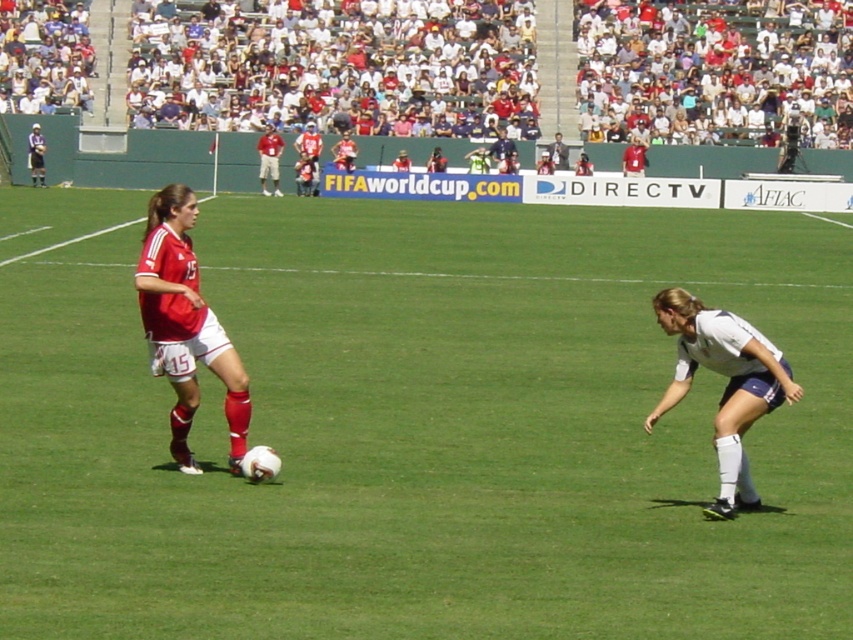
Question: Considering the real-world distances, which object is farthest from the matte red jersey at left?

Choices:
 (A) white matte shorts at lower right
 (B) white cotton crowd at upper center

Answer: (B)

Question: Is green grass soccer field at center to the left of matte red jersey at left from the viewer's perspective?

Choices:
 (A) yes
 (B) no

Answer: (B)

Question: Does matte red jersey at left lie behind white matte shorts at lower right?

Choices:
 (A) no
 (B) yes

Answer: (B)

Question: Estimate the real-world distances between objects in this image. Which object is closer to the white cotton crowd at upper center?

Choices:
 (A) white matte shorts at lower right
 (B) green grass soccer field at center

Answer: (B)

Question: Which point appears closest to the camera in this image?

Choices:
 (A) (734, 506)
 (B) (444, 216)
 (C) (144, 301)
 (D) (733, 74)

Answer: (A)

Question: Considering the relative positions of green grass soccer field at center and matte red jersey at left in the image provided, where is green grass soccer field at center located with respect to matte red jersey at left?

Choices:
 (A) below
 (B) above

Answer: (B)